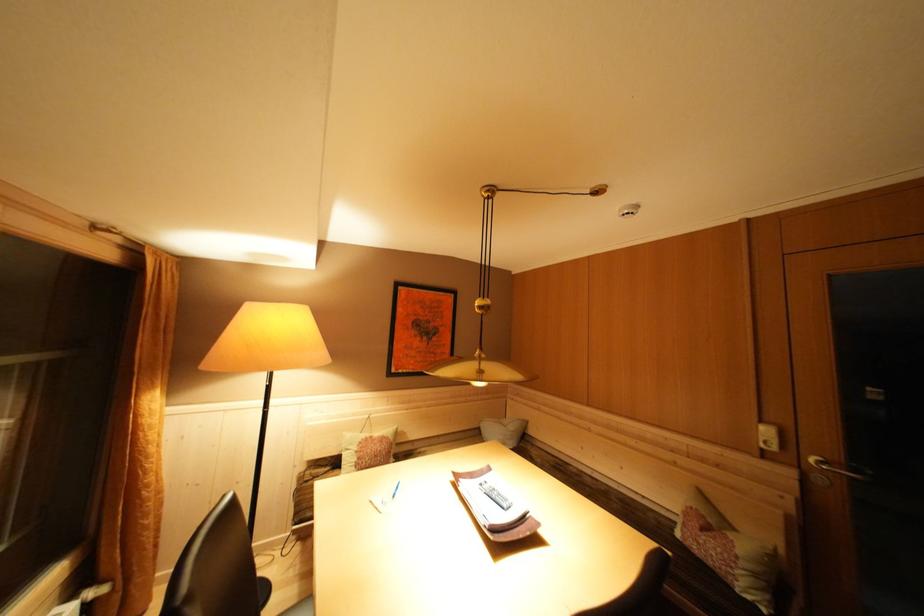
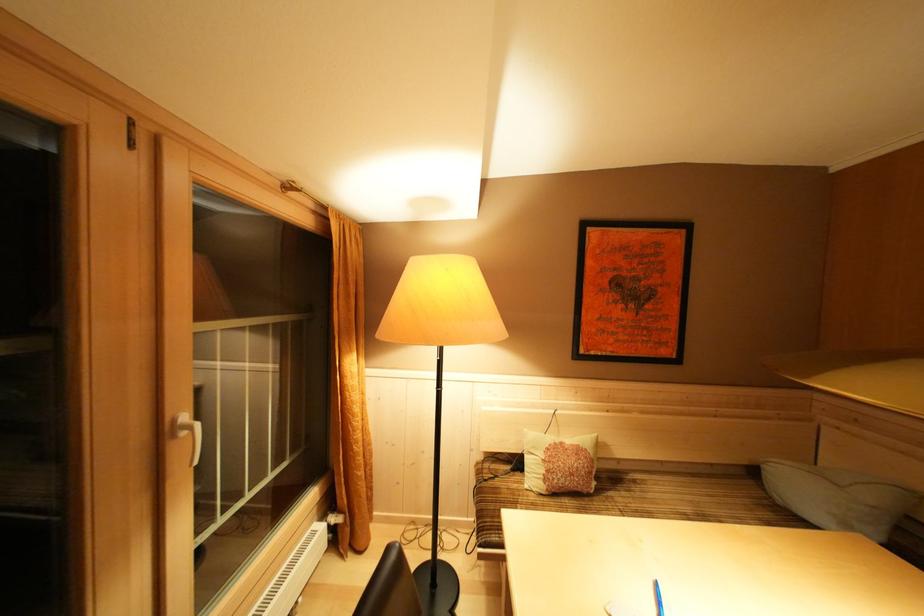
Question: How did the camera likely rotate?

Choices:
 (A) Left
 (B) Right
 (C) Up
 (D) Down

Answer: (A)